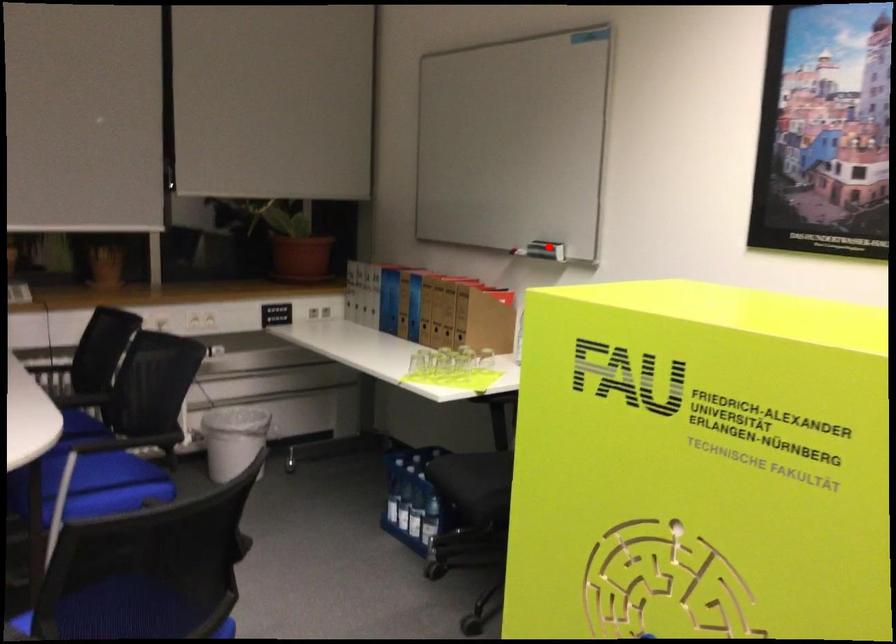
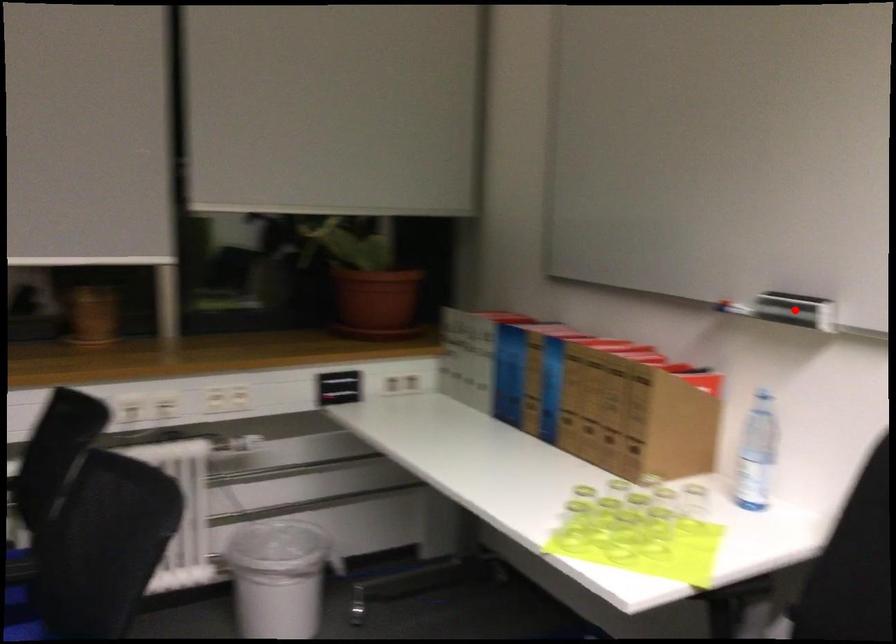
I am providing you with two images of the same scene from different viewpoints. A red point is marked on the first image and another point is marked on the second image. Is the marked point in image1 the same physical position as the marked point in image2?

Yes